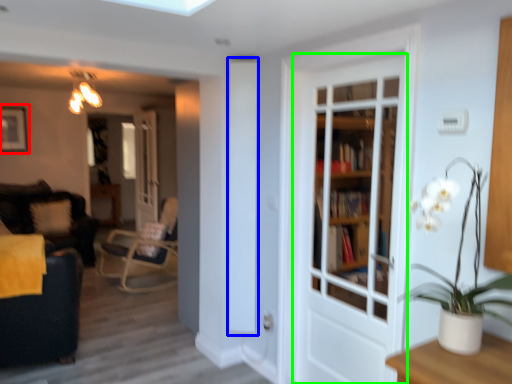
Question: Which is nearer to the picture frame (highlighted by a red box)? screen door (highlighted by a blue box) or door (highlighted by a green box).

Choices:
 (A) screen door
 (B) door

Answer: (A)